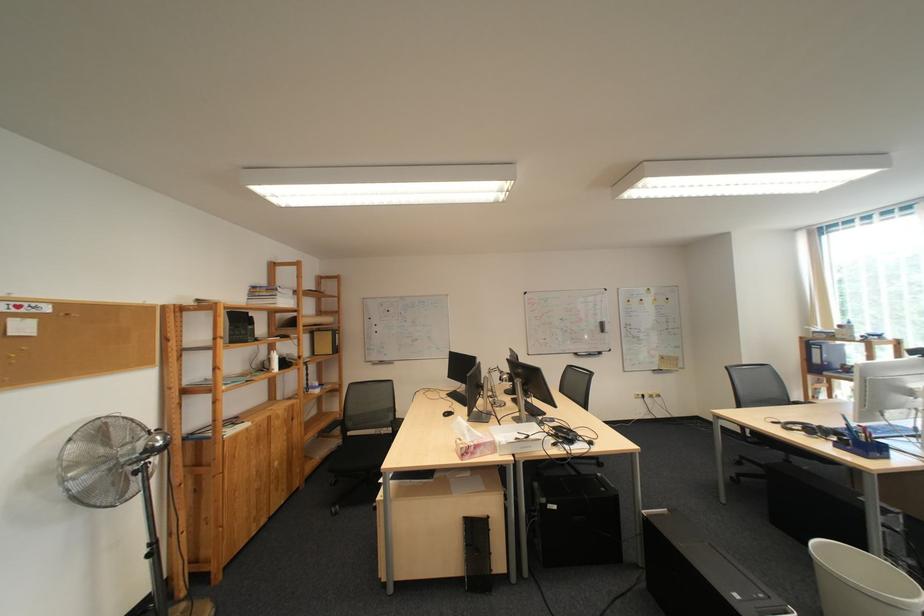
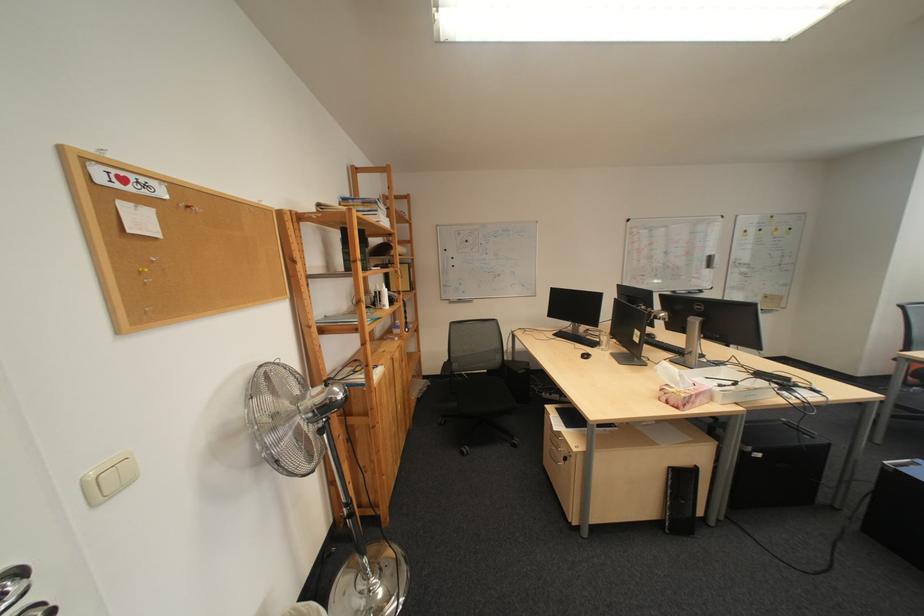
Locate, in the second image, the point that corresponds to point 462,395 in the first image.

(568, 336)